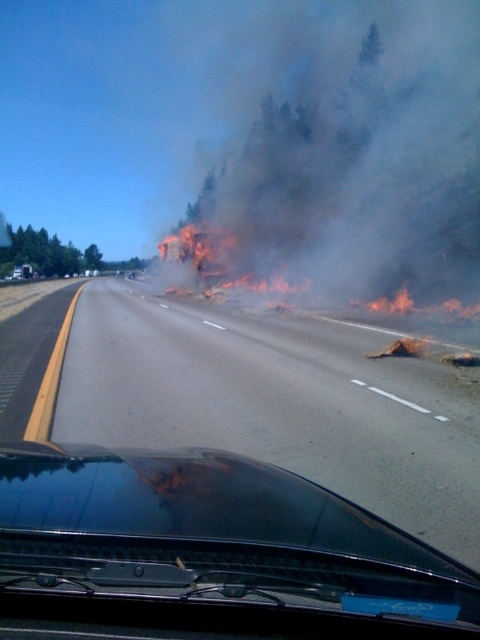
Can you confirm if black smoke at upper center is positioned below transparent glass windshield at center?

Actually, black smoke at upper center is above transparent glass windshield at center.

Is black smoke at upper center to the right of transparent glass windshield at center from the viewer's perspective?

Yes, black smoke at upper center is to the right of transparent glass windshield at center.

Is point (225, 259) positioned after point (34, 628)?

Yes, point (225, 259) is farther from viewer.

The image size is (480, 640). In order to click on black smoke at upper center in this screenshot , I will do `click(348, 157)`.

Does point (247, 355) come farther from viewer compared to point (400, 113)?

No, (247, 355) is in front of (400, 113).

Does asphalt road at center appear under black smoke at upper center?

Correct, asphalt road at center is located below black smoke at upper center.

Does point (74, 404) come closer to viewer compared to point (312, 240)?

Yes, it is in front of point (312, 240).

This screenshot has width=480, height=640. In order to click on asphalt road at center in this screenshot , I will do `click(249, 438)`.

Does asphalt road at center have a lesser width compared to transparent glass windshield at center?

No, asphalt road at center is not thinner than transparent glass windshield at center.

Between point (136, 456) and point (129, 461), which one is positioned in front?

Positioned in front is point (129, 461).

Find the location of a particular element. asphalt road at center is located at coordinates (249, 438).